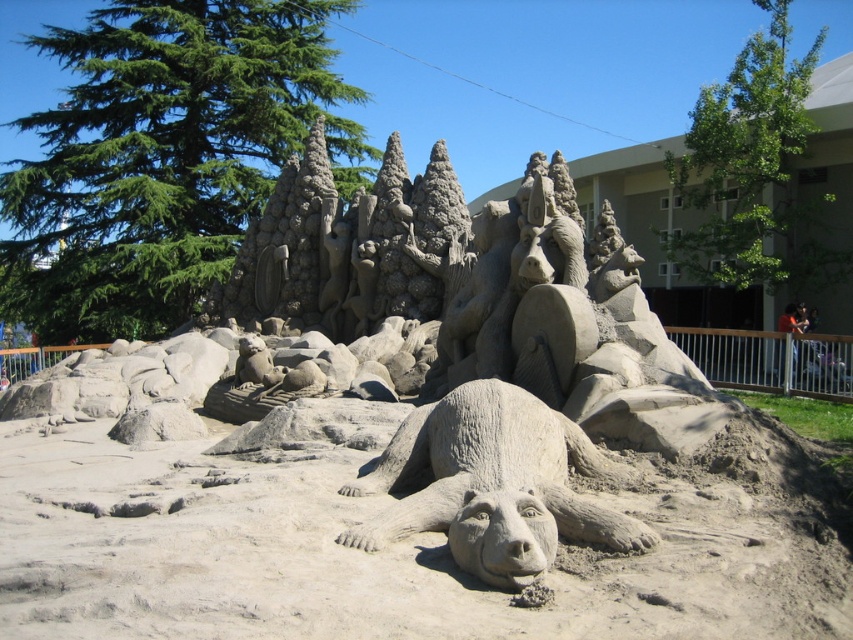
Is gray sand sculpture at center positioned at the back of green coniferous tree at upper left?

No, gray sand sculpture at center is closer to the viewer.

Between point (109, 568) and point (4, 272), which one is positioned in front?

Point (109, 568) is more forward.

Is point (306, 595) positioned after point (279, 115)?

No, it is not.

You are a GUI agent. You are given a task and a screenshot of the screen. Output one action in this format:
    pyautogui.click(x=<x>, y=<y>)
    Task: Click on the gray sand sculpture at center
    The height and width of the screenshot is (640, 853).
    Given the screenshot: What is the action you would take?
    pyautogui.click(x=395, y=550)

Is green coniferous tree at upper left in front of gray textured bear at center?

That is False.

Can you confirm if green coniferous tree at upper left is positioned below gray textured bear at center?

Actually, green coniferous tree at upper left is above gray textured bear at center.

Find the location of `green coniferous tree at upper left`. green coniferous tree at upper left is located at coordinates (157, 156).

Where is `green coniferous tree at upper left`? green coniferous tree at upper left is located at coordinates (157, 156).

Does gray sand sculpture at center have a greater width compared to gray textured bear at center?

No, gray sand sculpture at center is not wider than gray textured bear at center.

The height and width of the screenshot is (640, 853). What do you see at coordinates (395, 550) in the screenshot?
I see `gray sand sculpture at center` at bounding box center [395, 550].

At what (x,y) coordinates should I click in order to perform the action: click on gray sand sculpture at center. Please return your answer as a coordinate pair (x, y). The width and height of the screenshot is (853, 640). Looking at the image, I should click on (395, 550).